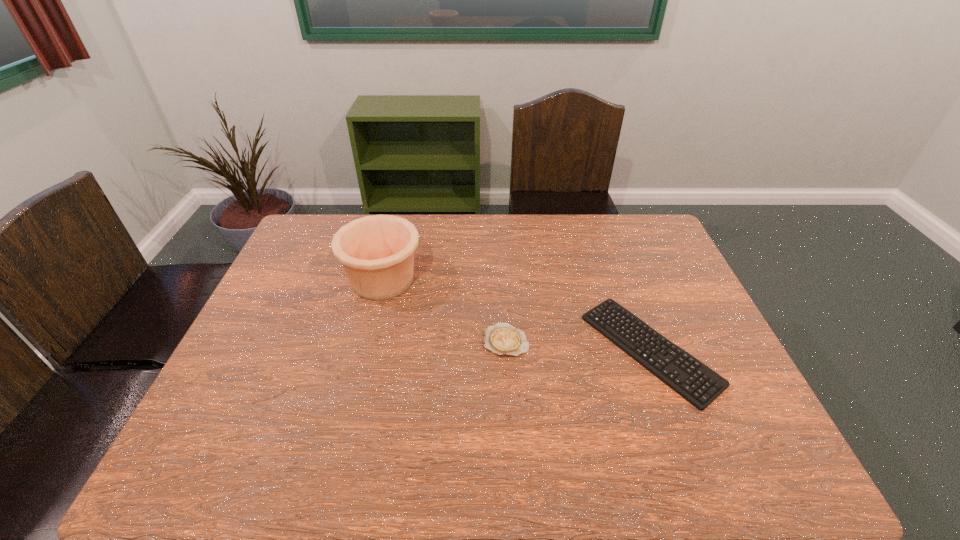
The height and width of the screenshot is (540, 960). What are the coordinates of `the leftmost object` in the screenshot? It's located at (377, 252).

Find the location of a particular element. the tallest object is located at coordinates (377, 252).

This screenshot has width=960, height=540. Identify the location of the second object from left to right. (502, 339).

Where is `the rightmost object`? This screenshot has width=960, height=540. the rightmost object is located at coordinates (694, 381).

You are a GUI agent. You are given a task and a screenshot of the screen. Output one action in this format:
    pyautogui.click(x=<x>, y=<y>)
    Task: Click on the blank space located on the right of the leftmost object
    
    Given the screenshot: What is the action you would take?
    pyautogui.click(x=448, y=280)

Identify the location of free region located on the back of the quiche. This screenshot has width=960, height=540. (504, 305).

Locate an element on the screen. Image resolution: width=960 pixels, height=540 pixels. vacant space located on the left of the rightmost object is located at coordinates (452, 349).

The height and width of the screenshot is (540, 960). Find the location of `object at the right edge`. object at the right edge is located at coordinates (694, 381).

This screenshot has height=540, width=960. Identify the location of free space at the far edge of the desktop. (553, 222).

You are a GUI agent. You are given a task and a screenshot of the screen. Output one action in this format:
    pyautogui.click(x=<x>, y=<y>)
    Task: Click on the free space at the near edge of the desktop
    The height and width of the screenshot is (540, 960).
    Given the screenshot: What is the action you would take?
    pyautogui.click(x=504, y=467)